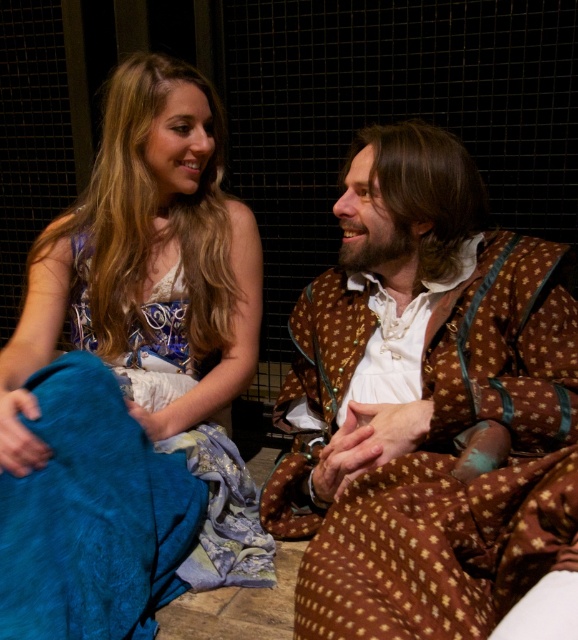
You are an assistant helping to set up a stage for a play. You need to place a decorative item between the brown textured fabric at right and the silky blue fabric at lower left. Which fabric should you place the item closer to if you want it to appear more prominent on stage?

You should place the decorative item closer to the brown textured fabric at right because it is closer to the viewer, making it more prominent on stage.

You are a costume designer working on a play where two actors need to move closely together. You have a brown textured fabric at right and a silky blue fabric at lower left. Given the distance between them, can the actors move within 15 inches of each other without their costumes touching?

The brown textured fabric at right is 15.27 inches from silky blue fabric at lower left. Since the distance is slightly more than 15 inches, the actors can move within 15 inches of each other without their costumes touching.